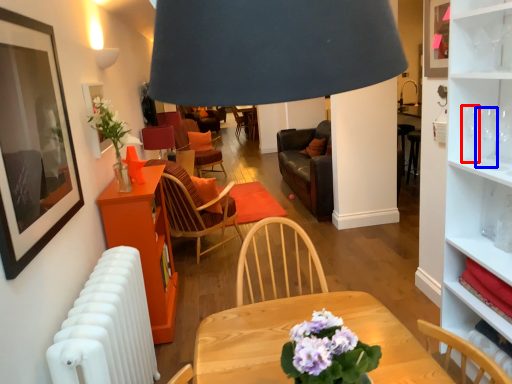
Question: Which object is closer to the camera taking this photo, wine glass (highlighted by a red box) or wine glass (highlighted by a blue box)?

Choices:
 (A) wine glass
 (B) wine glass

Answer: (B)